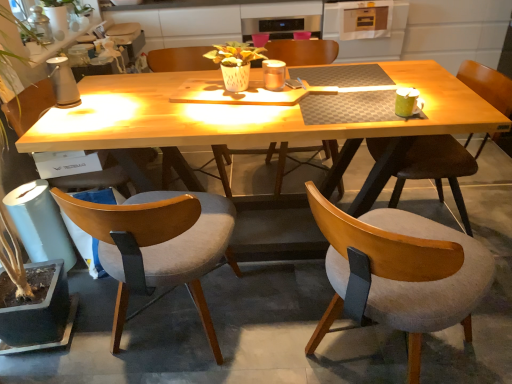
Question: From a real-world perspective, relative to wooden chair at center, arranged as the third chair when viewed from the left, is light gray fabric chair at lower left, the 4th chair positioned from the right, vertically above or below?

Choices:
 (A) below
 (B) above

Answer: (A)

Question: Is light gray fabric chair at lower left, the 4th chair positioned from the right, spatially inside wooden chair at center, which appears as the third chair when viewed from the right, or outside of it?

Choices:
 (A) outside
 (B) inside

Answer: (A)

Question: Which object is positioned farthest from the green leafy plant at left?

Choices:
 (A) wooden upholstered chair at right, placed as the fifth chair when sorted from left to right
 (B) metallic silver oven at upper center
 (C) wooden chair at center, arranged as the third chair when viewed from the left
 (D) wooden chair at center, the second chair in the right-to-left sequence
 (E) light gray fabric chair at lower left, the 4th chair positioned from the right

Answer: (B)

Question: Which object is the closest to the wooden chair at center, the second chair in the right-to-left sequence?

Choices:
 (A) light brown wood chair at lower left, arranged as the fifth chair when viewed from the right
 (B) wooden upholstered chair at right, which appears as the 1th chair when viewed from the right
 (C) metallic silver oven at upper center
 (D) light gray fabric chair at lower left, which is the 2th chair in left-to-right order
 (E) wooden chair at center, which appears as the third chair when viewed from the right

Answer: (D)